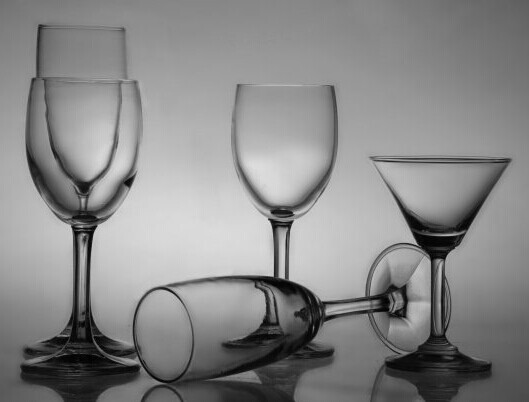
Image resolution: width=529 pixels, height=402 pixels. Identify the location of glass. (434, 217), (243, 322), (290, 116), (48, 166), (86, 55).